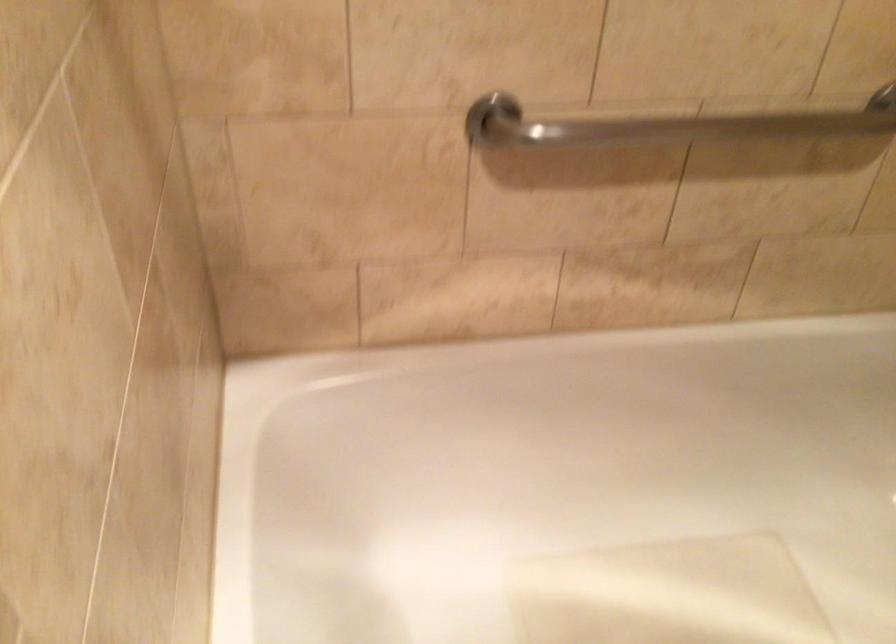
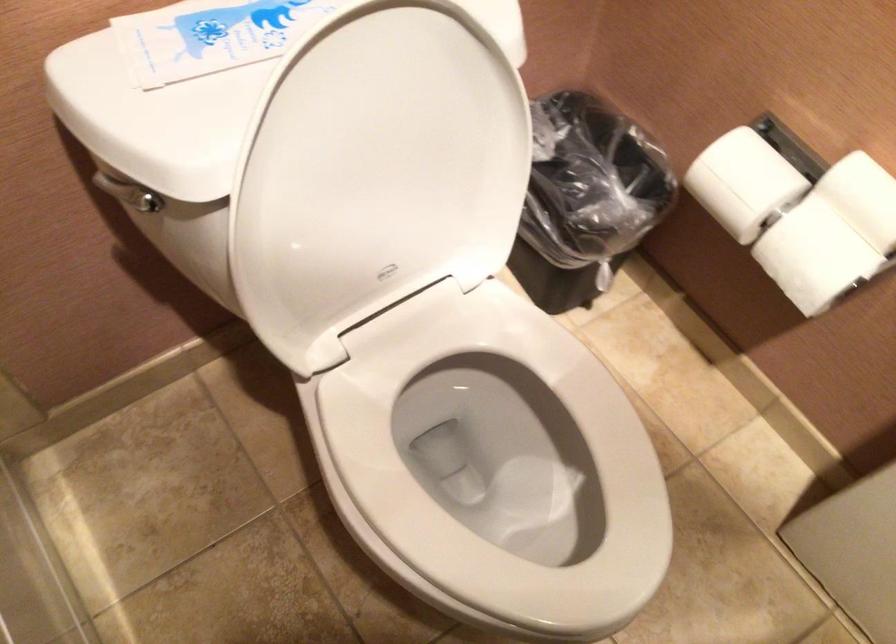
Based on the continuous images, in which direction is the camera rotating?

The camera's rotation is toward right-down.